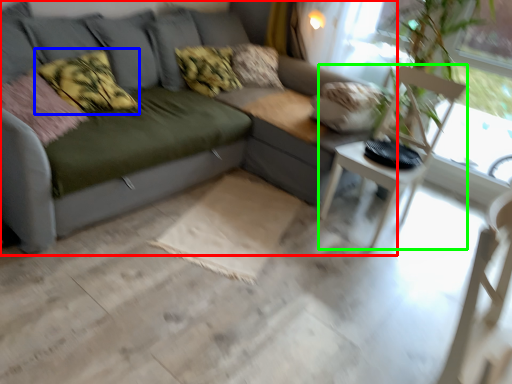
Question: Which is farther away from studio couch (highlighted by a red box)? pillow (highlighted by a blue box) or armchair (highlighted by a green box)?

Choices:
 (A) pillow
 (B) armchair

Answer: (A)